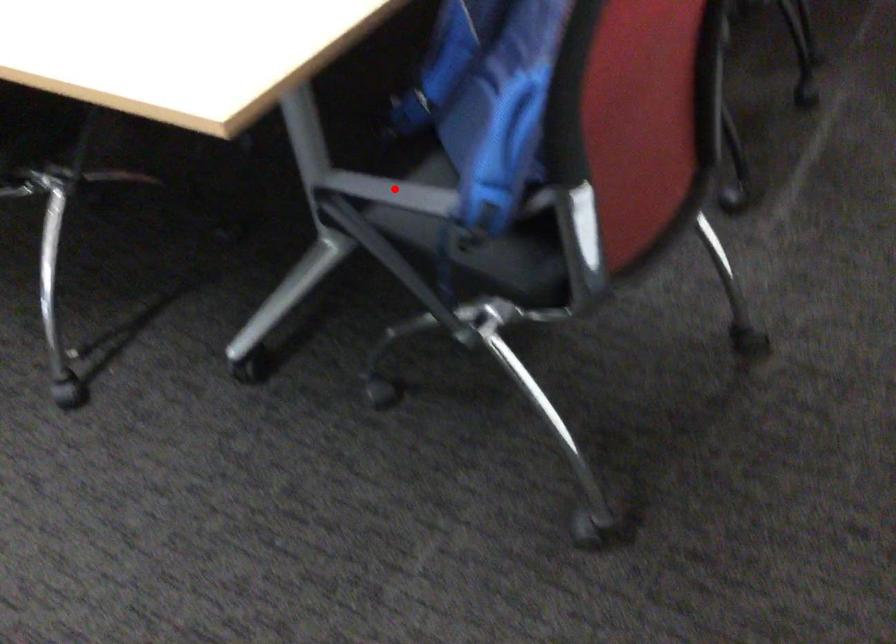
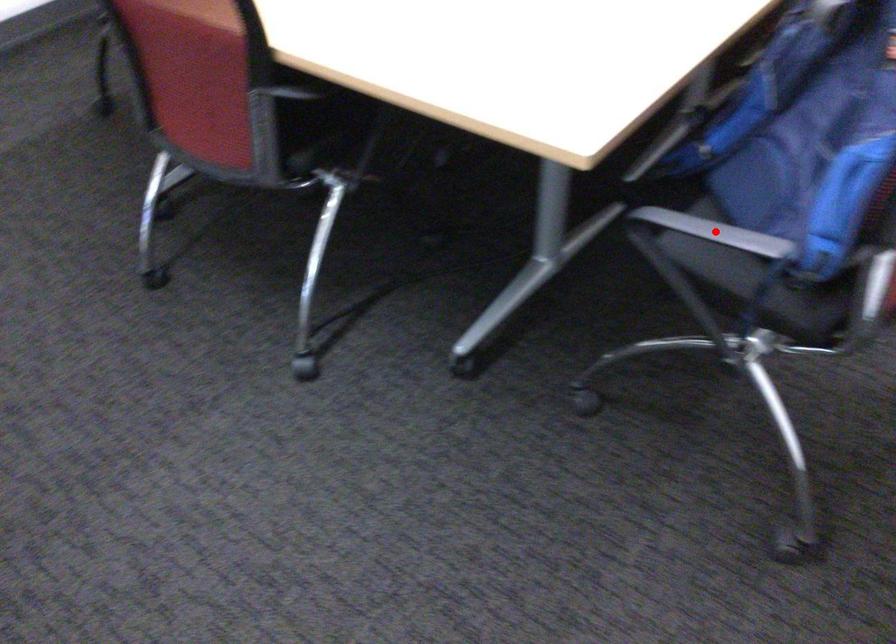
I am providing you with two images of the same scene from different viewpoints. A red point is marked on the first image and another point is marked on the second image. Is the red point in image1 aligned with the point shown in image2?

Yes